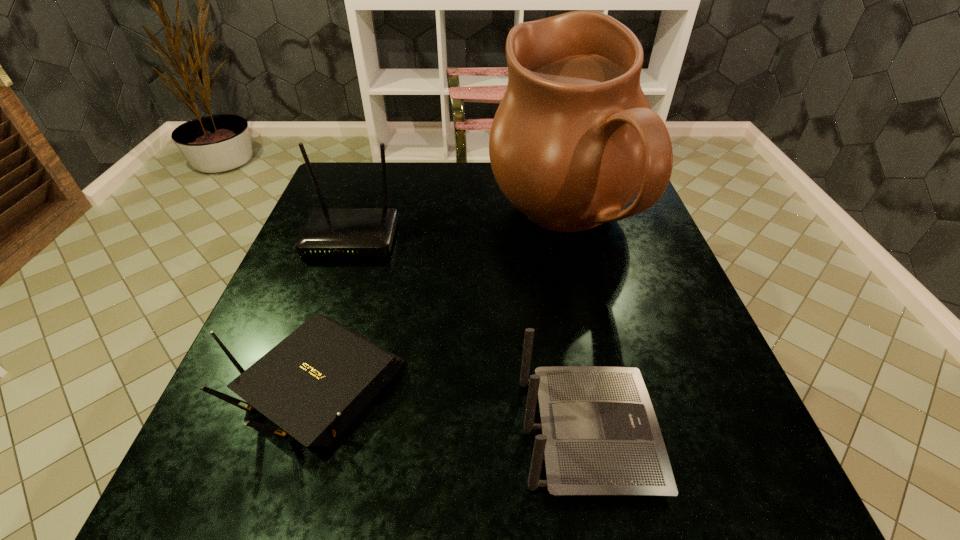
This screenshot has height=540, width=960. I want to click on free space at the right edge of the desktop, so click(620, 320).

I want to click on vacant area at the near left corner, so click(275, 461).

The width and height of the screenshot is (960, 540). I want to click on free space between the cream pitcher and the farthest router, so click(x=458, y=231).

This screenshot has height=540, width=960. What are the coordinates of `free space between the third shortest object and the shortest object` in the screenshot? It's located at (334, 310).

I want to click on unoccupied area between the shortest object and the tallest object, so click(x=441, y=303).

This screenshot has width=960, height=540. What are the coordinates of `vacant area that lies between the tallest object and the second shortest object` in the screenshot? It's located at (576, 328).

Image resolution: width=960 pixels, height=540 pixels. In order to click on vacant area that lies between the cream pitcher and the farthest router in this screenshot , I will do `click(458, 231)`.

At what (x,y) coordinates should I click in order to perform the action: click on free space between the rightmost router and the shortest object. Please return your answer as a coordinate pair (x, y). This screenshot has height=540, width=960. Looking at the image, I should click on (452, 408).

You are a GUI agent. You are given a task and a screenshot of the screen. Output one action in this format:
    pyautogui.click(x=<x>, y=<y>)
    Task: Click on the empty space that is in between the shortest router and the second tallest object
    This screenshot has width=960, height=540.
    Given the screenshot: What is the action you would take?
    pyautogui.click(x=334, y=310)

Identify the location of free space between the third tallest object and the farthest router. The height and width of the screenshot is (540, 960). (469, 335).